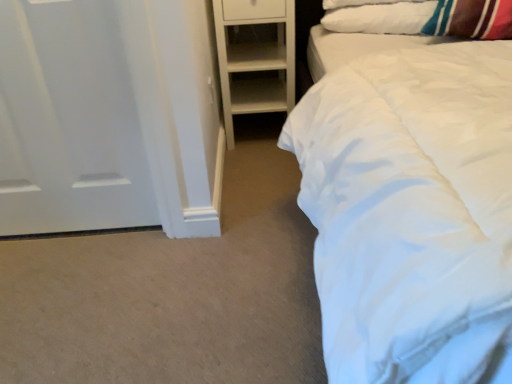
Question: From the image's perspective, relative to white soft pillow at upper right, is white matte door at left above or below?

Choices:
 (A) below
 (B) above

Answer: (A)

Question: Is white matte door at left in front of or behind white soft pillow at upper right in the image?

Choices:
 (A) behind
 (B) front

Answer: (B)

Question: Considering the real-world distances, which object is closest to the white matte door at left?

Choices:
 (A) white matte wooden shelf at center
 (B) white soft pillow at upper right

Answer: (A)

Question: Considering the real-world distances, which object is farthest from the white matte wooden shelf at center?

Choices:
 (A) white soft pillow at upper right
 (B) white matte door at left

Answer: (B)